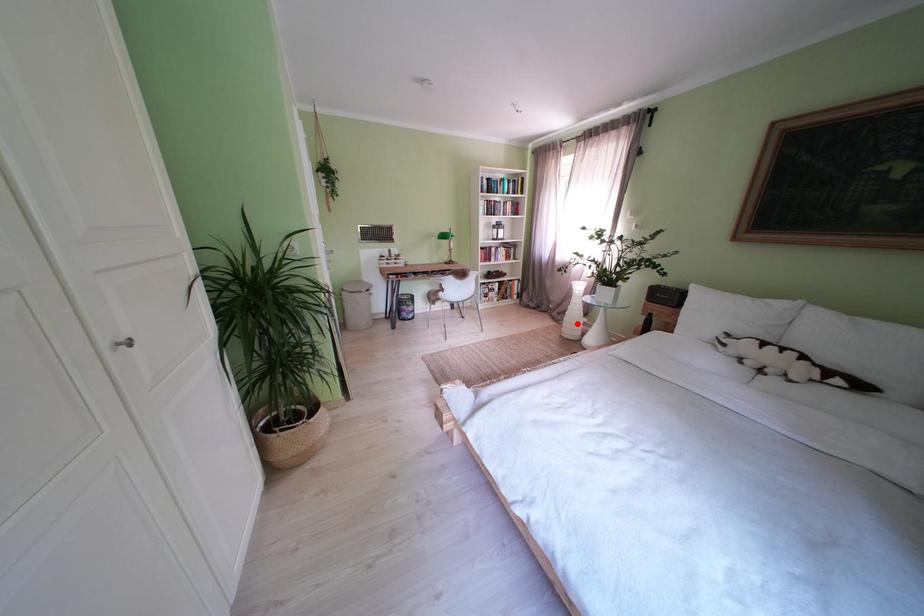
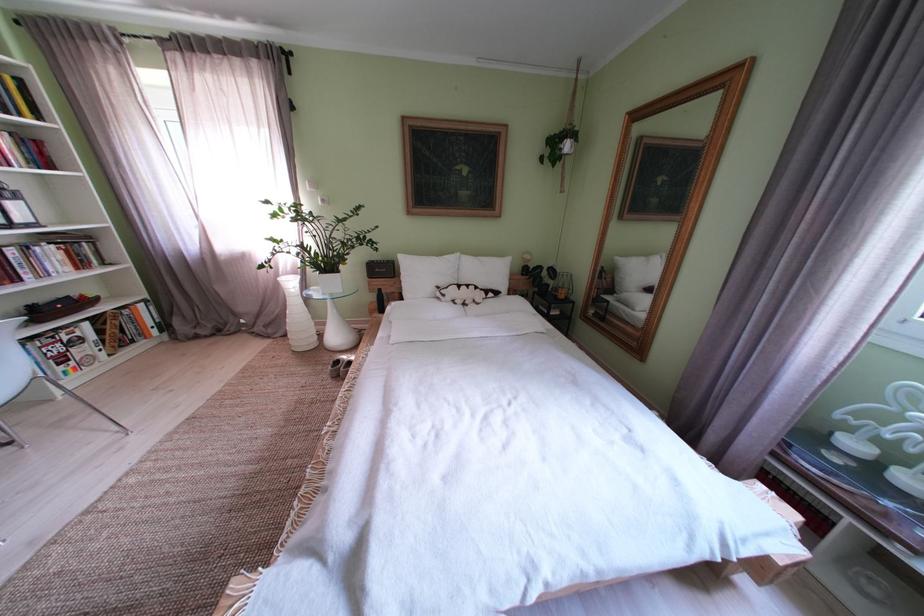
Question: A red point is marked in image1. In image2, is the corresponding 3D point closer to the camera or farther? Reply with the corresponding letter.

Choices:
 (A) The corresponding 3D point is closer.
 (B) The corresponding 3D point is farther.

Answer: (B)